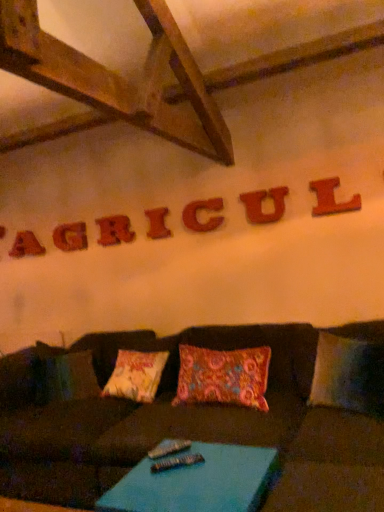
Find the location of a particular element. free space to the right of metallic silver remote at center is located at coordinates (205, 455).